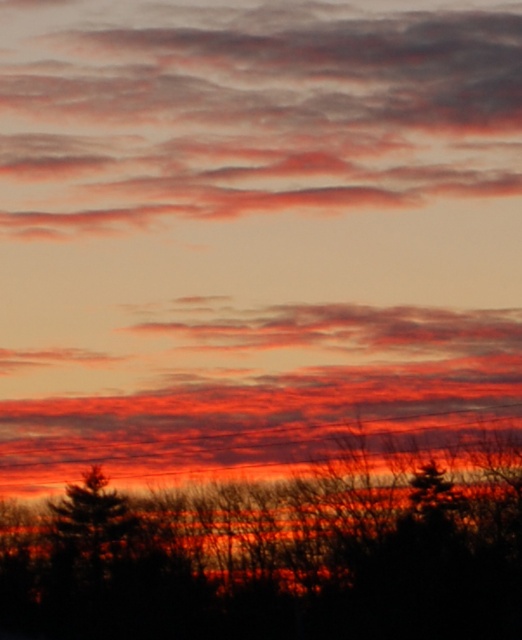
What do you see at coordinates (251, 108) in the screenshot? I see `matte orange cloud at upper center` at bounding box center [251, 108].

Is point (106, 173) behind point (81, 538)?

Yes, point (106, 173) is farther from viewer.

The image size is (522, 640). In order to click on matte orange cloud at upper center in this screenshot , I will do `click(251, 108)`.

Does silhouette bare tree at bottom have a greater width compared to green matte tree at lower left?

Yes, silhouette bare tree at bottom is wider than green matte tree at lower left.

Is point (336, 486) farther from camera compared to point (65, 497)?

No, it is in front of (65, 497).

At what (x,y) coordinates should I click in order to perform the action: click on silhouette bare tree at bottom. Please return your answer as a coordinate pair (x, y). This screenshot has height=640, width=522. Looking at the image, I should click on (280, 550).

Which is behind, point (319, 154) or point (311, 484)?

The point (319, 154) is behind.

Is point (326, 147) positioned in front of point (328, 467)?

No.

Identify the location of matte orange cloud at upper center. (251, 108).